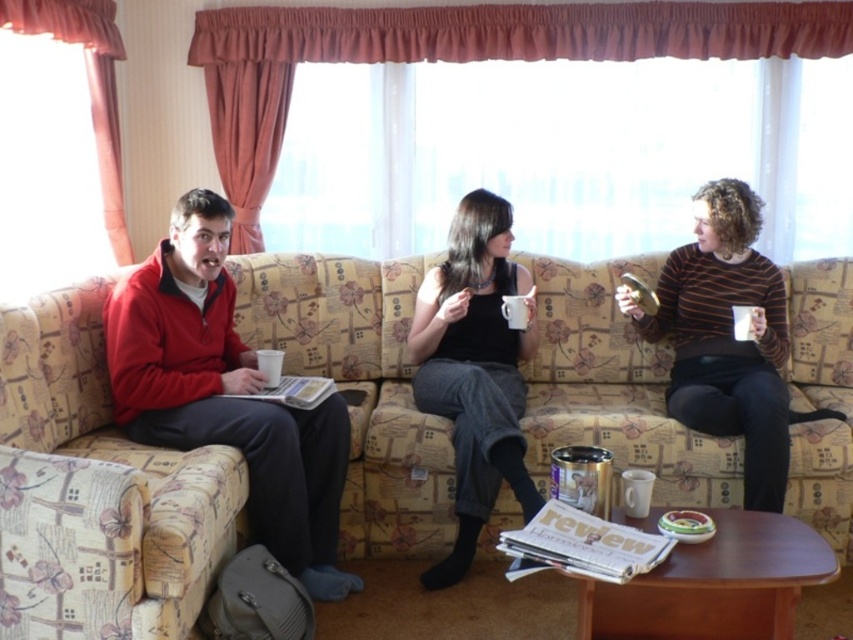
Question: Which of the following is the farthest from the observer?

Choices:
 (A) (497, 508)
 (B) (726, 321)
 (C) (494, 413)

Answer: (B)

Question: Which of the following is the farthest from the observer?

Choices:
 (A) striped sweater at right
 (B) matte black tank top at center
 (C) matte red sweater at left
 (D) beige floral fabric couch at center

Answer: (D)

Question: Is striped sweater at right further to camera compared to matte black tank top at center?

Choices:
 (A) no
 (B) yes

Answer: (B)

Question: In this image, where is matte red sweater at left located relative to matte black tank top at center?

Choices:
 (A) left
 (B) right

Answer: (A)

Question: Is beige floral fabric couch at center in front of matte black tank top at center?

Choices:
 (A) yes
 (B) no

Answer: (B)

Question: Based on their relative distances, which object is farther from the matte red sweater at left?

Choices:
 (A) beige floral fabric couch at center
 (B) matte black tank top at center

Answer: (B)